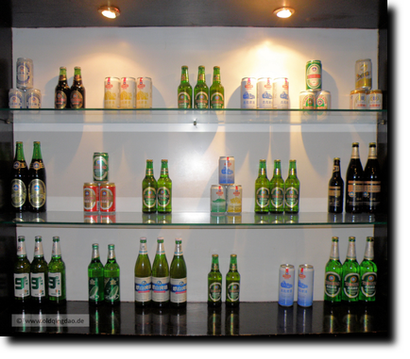
The width and height of the screenshot is (410, 359). I want to click on glass shelf, so click(x=167, y=107), click(x=197, y=216), click(x=203, y=321).